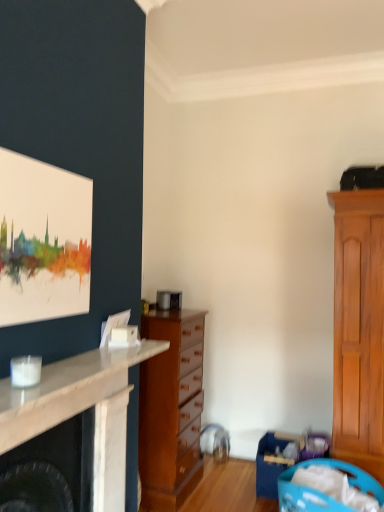
Question: Does watercolor canvas at upper left contain blue plastic laundry basket at lower right, the first laundry basket when ordered from back to front?

Choices:
 (A) no
 (B) yes

Answer: (A)

Question: From the image's perspective, is watercolor canvas at upper left on top of blue plastic laundry basket at lower right, the second laundry basket when ordered from front to back?

Choices:
 (A) no
 (B) yes

Answer: (B)

Question: Is watercolor canvas at upper left facing away from blue plastic laundry basket at lower right, the first laundry basket when ordered from back to front?

Choices:
 (A) yes
 (B) no

Answer: (B)

Question: Considering the relative sizes of watercolor canvas at upper left and blue plastic laundry basket at lower right, the second laundry basket when ordered from front to back, in the image provided, is watercolor canvas at upper left bigger than blue plastic laundry basket at lower right, the second laundry basket when ordered from front to back,?

Choices:
 (A) yes
 (B) no

Answer: (B)

Question: Is watercolor canvas at upper left at the left side of blue plastic laundry basket at lower right, the first laundry basket when ordered from back to front?

Choices:
 (A) no
 (B) yes

Answer: (B)

Question: From a real-world perspective, is watercolor canvas at upper left positioned under blue plastic laundry basket at lower right, the first laundry basket when ordered from back to front, based on gravity?

Choices:
 (A) yes
 (B) no

Answer: (B)

Question: Is wooden chest of drawers at center positioned beyond the bounds of white marble fireplace at left?

Choices:
 (A) no
 (B) yes

Answer: (B)

Question: Is wooden chest of drawers at center smaller than white marble fireplace at left?

Choices:
 (A) no
 (B) yes

Answer: (A)

Question: From the image's perspective, is wooden chest of drawers at center under white marble fireplace at left?

Choices:
 (A) yes
 (B) no

Answer: (A)

Question: Is wooden chest of drawers at center bigger than white marble fireplace at left?

Choices:
 (A) yes
 (B) no

Answer: (A)

Question: Is wooden chest of drawers at center further to camera compared to white marble fireplace at left?

Choices:
 (A) no
 (B) yes

Answer: (B)

Question: Is wooden chest of drawers at center placed right next to white marble fireplace at left?

Choices:
 (A) yes
 (B) no

Answer: (B)

Question: From a real-world perspective, is blue plastic laundry basket at lower right, the second laundry basket when ordered from back to front, positioned over white marble fireplace at left based on gravity?

Choices:
 (A) no
 (B) yes

Answer: (A)